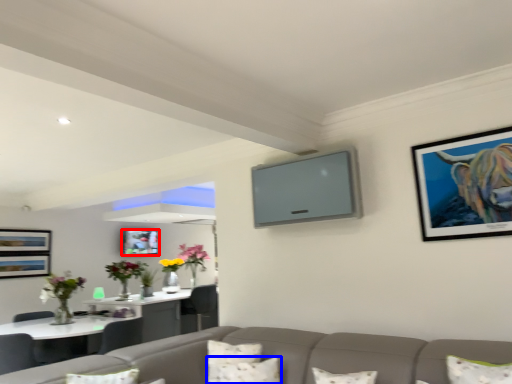
Question: Which object is further to the camera taking this photo, picture frame (highlighted by a red box) or pillow (highlighted by a blue box)?

Choices:
 (A) picture frame
 (B) pillow

Answer: (A)